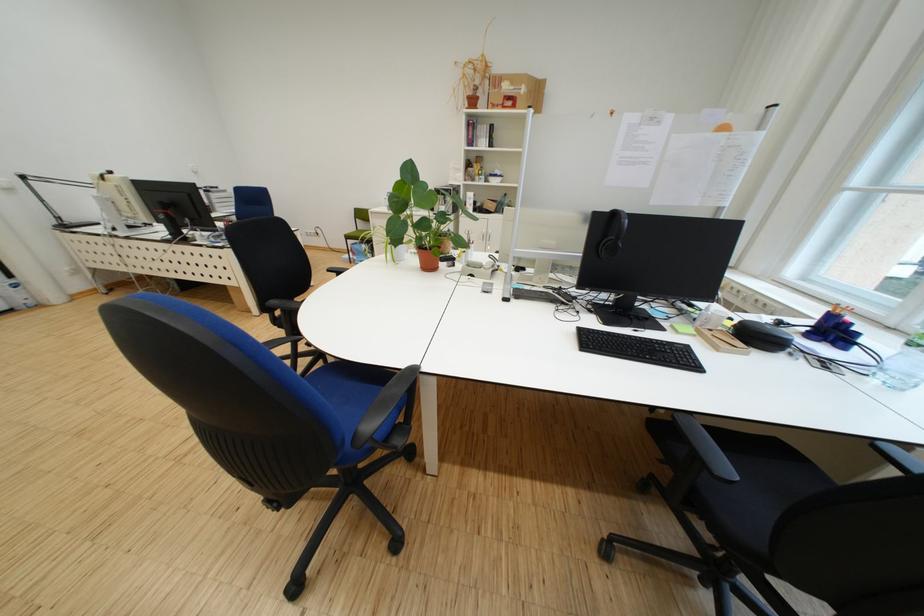
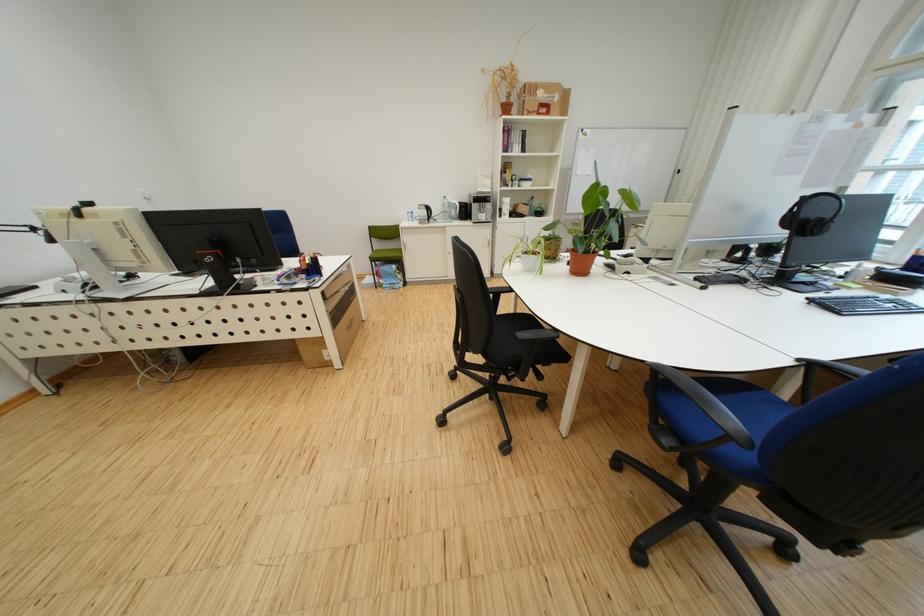
Where in the second image is the point corresponding to the point at 236,288 from the first image?

(306, 342)